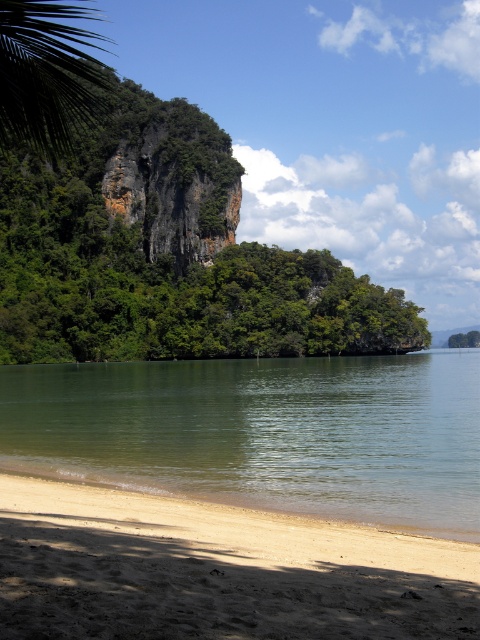
Between light brown sandy beach at lower left and green leafy palm tree at upper left, which one has less height?

light brown sandy beach at lower left is shorter.

Which is in front, point (8, 604) or point (22, 80)?

Point (8, 604) is more forward.

Is point (339, 588) closer to camera compared to point (43, 97)?

No, it is not.

Where is `light brown sandy beach at lower left`? light brown sandy beach at lower left is located at coordinates [x=217, y=572].

Is green smooth water at lower left positioned behind green leafy palm tree at upper left?

Yes, it is.

Can you confirm if green smooth water at lower left is wider than green leafy palm tree at upper left?

Yes.

Locate an element on the screen. This screenshot has height=640, width=480. green smooth water at lower left is located at coordinates (264, 433).

This screenshot has width=480, height=640. In order to click on green smooth water at lower left in this screenshot , I will do `click(264, 433)`.

Does green smooth water at lower left have a greater height compared to light brown sandy beach at lower left?

No.

Between point (189, 429) and point (228, 513), which one is positioned behind?

The point (189, 429) is more distant.

What are the coordinates of `green smooth water at lower left` in the screenshot? It's located at (264, 433).